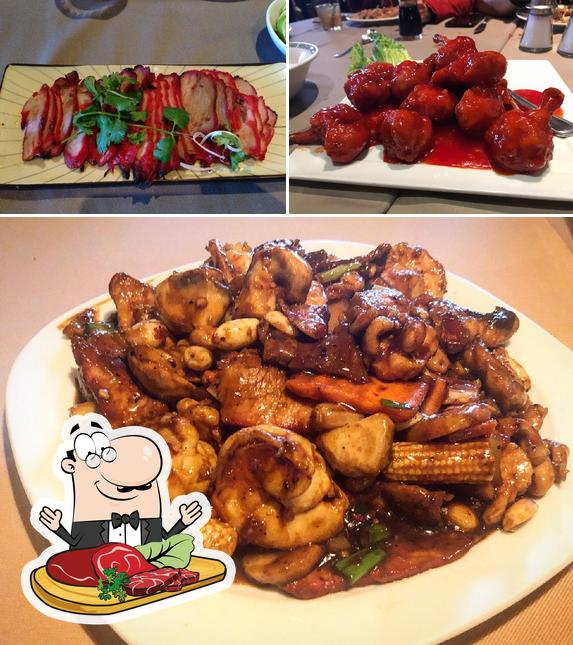
At what (x,y) coordinates should I click in order to perform the action: click on long plate rectangular. Please return your answer as a coordinate pair (x, y). Image resolution: width=573 pixels, height=645 pixels. Looking at the image, I should click on (13, 177).